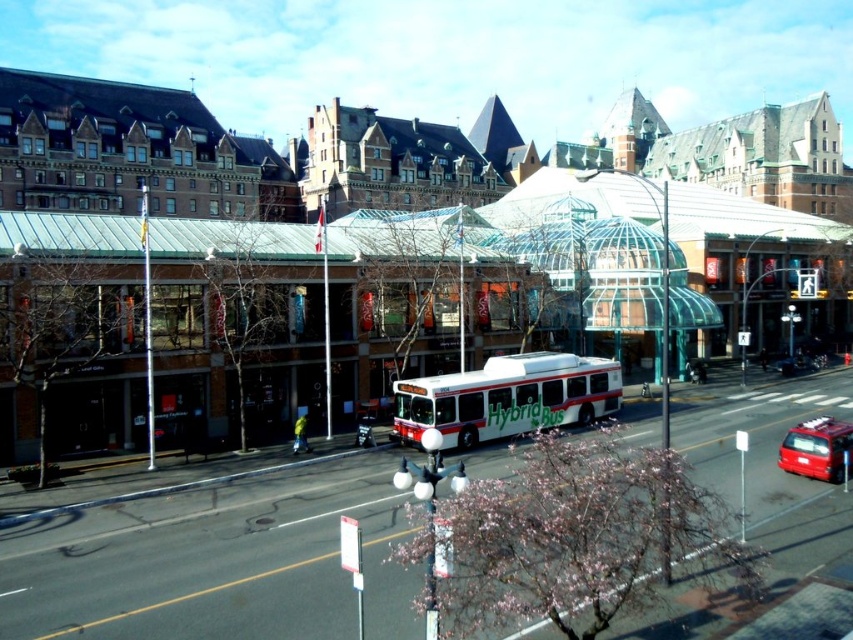
Does white hybrid bus at center have a lesser width compared to shiny red van at lower right?

No, white hybrid bus at center is not thinner than shiny red van at lower right.

Is point (612, 365) positioned behind point (787, 449)?

Yes, it is.

At what (x,y) coordinates should I click in order to perform the action: click on white hybrid bus at center. Please return your answer as a coordinate pair (x, y). The image size is (853, 640). Looking at the image, I should click on (x=506, y=397).

Who is shorter, white hybrid bus at center or metallic red car at center?

With less height is metallic red car at center.

What do you see at coordinates (506, 397) in the screenshot?
I see `white hybrid bus at center` at bounding box center [506, 397].

In order to click on white hybrid bus at center in this screenshot , I will do `click(506, 397)`.

The image size is (853, 640). Identify the location of white hybrid bus at center. (506, 397).

Who is more distant from viewer, [796,440] or [798,369]?

The point [798,369] is behind.

In the scene shown: Is shiny red van at lower right positioned in front of metallic red car at center?

Yes, it is.

Locate an element on the screen. shiny red van at lower right is located at coordinates (817, 449).

Find the location of a particular element. Image resolution: width=853 pixels, height=640 pixels. shiny red van at lower right is located at coordinates (817, 449).